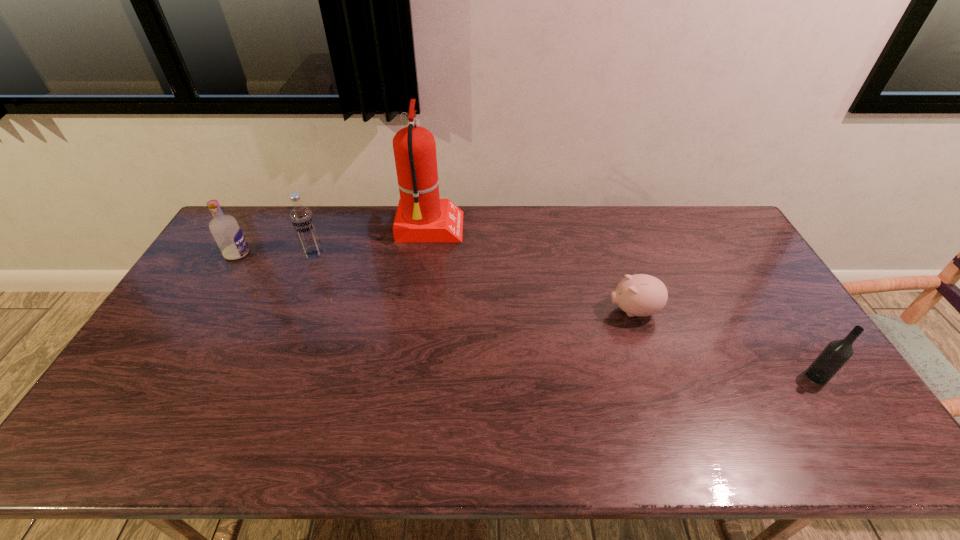
The width and height of the screenshot is (960, 540). In order to click on empty space that is in between the rightmost vodka and the leftmost object in this screenshot , I will do click(527, 315).

Where is `unoccupied area between the second nearest object and the nearest object`? unoccupied area between the second nearest object and the nearest object is located at coordinates 725,343.

Image resolution: width=960 pixels, height=540 pixels. What are the coordinates of `vacant area that lies between the shortest object and the third object from right to left` in the screenshot? It's located at (532, 270).

This screenshot has height=540, width=960. In order to click on unoccupied area between the piggy bank and the second vodka from right to left in this screenshot , I will do `click(473, 282)`.

Identify the location of unoccupied area between the second vodka from left to right and the nearest object. [565, 314].

Select which object is the closest to the second nearest object. Please provide its 2D coordinates. Your answer should be formatted as a tuple, i.e. [(x, y)], where the tuple contains the x and y coordinates of a point satisfying the conditions above.

[(837, 353)]

Point out which object is positioned as the second nearest to the leftmost vodka. Please provide its 2D coordinates. Your answer should be formatted as a tuple, i.e. [(x, y)], where the tuple contains the x and y coordinates of a point satisfying the conditions above.

[(421, 216)]

Choose which vodka is the second nearest neighbor to the leftmost object. Please provide its 2D coordinates. Your answer should be formatted as a tuple, i.e. [(x, y)], where the tuple contains the x and y coordinates of a point satisfying the conditions above.

[(837, 353)]

Locate an element on the screen. Image resolution: width=960 pixels, height=540 pixels. vodka that stands as the second closest to the fourth object from left to right is located at coordinates pyautogui.click(x=302, y=219).

Where is `free point that satisfies the following two spatial constraints: 1. on the label of the nearest object; 2. on the right side of the leftmost vodka`? The height and width of the screenshot is (540, 960). free point that satisfies the following two spatial constraints: 1. on the label of the nearest object; 2. on the right side of the leftmost vodka is located at coordinates (163, 376).